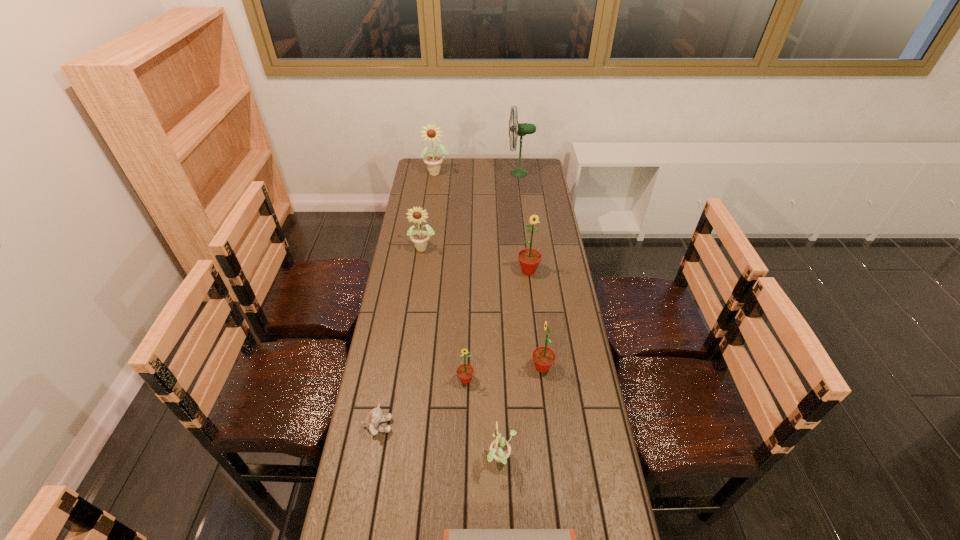
The height and width of the screenshot is (540, 960). In order to click on free point between the second farthest yellow sunflower and the tallest object in this screenshot , I will do `click(471, 210)`.

The height and width of the screenshot is (540, 960). In order to click on unoccupied position between the green fan and the second biggest yellow sunflower in this screenshot , I will do `click(471, 210)`.

Identify the location of empty location between the tallest object and the seventh farthest object. (448, 299).

This screenshot has height=540, width=960. Find the location of `free area in between the green fan and the gray teddy bear`. free area in between the green fan and the gray teddy bear is located at coordinates (448, 299).

I want to click on vacant area between the nearest sunflower and the fourth sunflower from right to left, so click(484, 420).

Find the location of a particular element. Image resolution: width=960 pixels, height=540 pixels. vacant area that lies between the fourth sunflower from left to right and the fourth sunflower from right to left is located at coordinates (484, 420).

This screenshot has width=960, height=540. Find the location of `vacant space that's between the fan and the second smallest yellow sunflower`. vacant space that's between the fan and the second smallest yellow sunflower is located at coordinates (471, 210).

This screenshot has height=540, width=960. What are the coordinates of `the closest object to the second farthest yellow sunflower` in the screenshot? It's located at (529, 259).

Where is `object that is the eighth closest to the nearest sunflower`? Image resolution: width=960 pixels, height=540 pixels. object that is the eighth closest to the nearest sunflower is located at coordinates (431, 133).

What are the coordinates of `sunflower object that ranks as the closest to the second biggest green sunflower` in the screenshot? It's located at (465, 372).